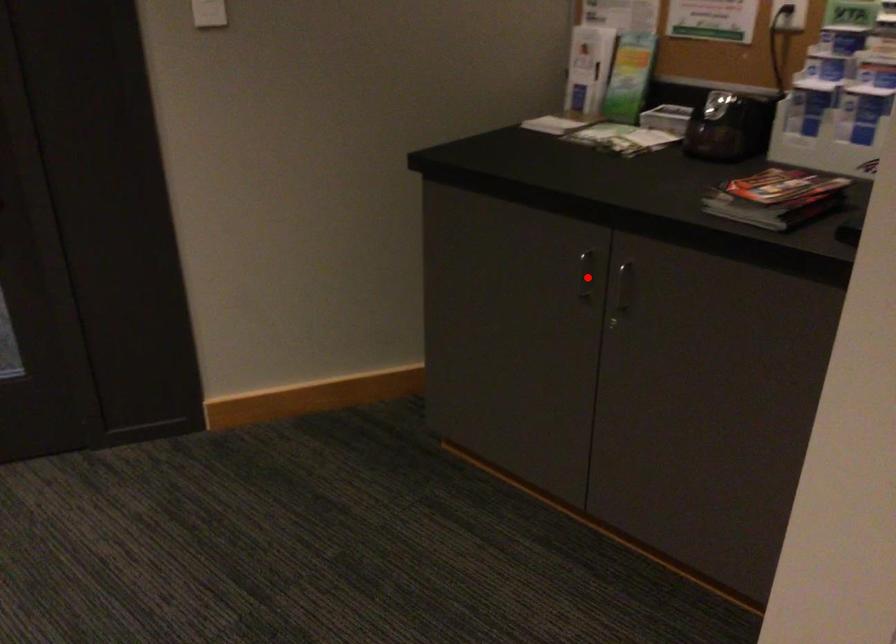
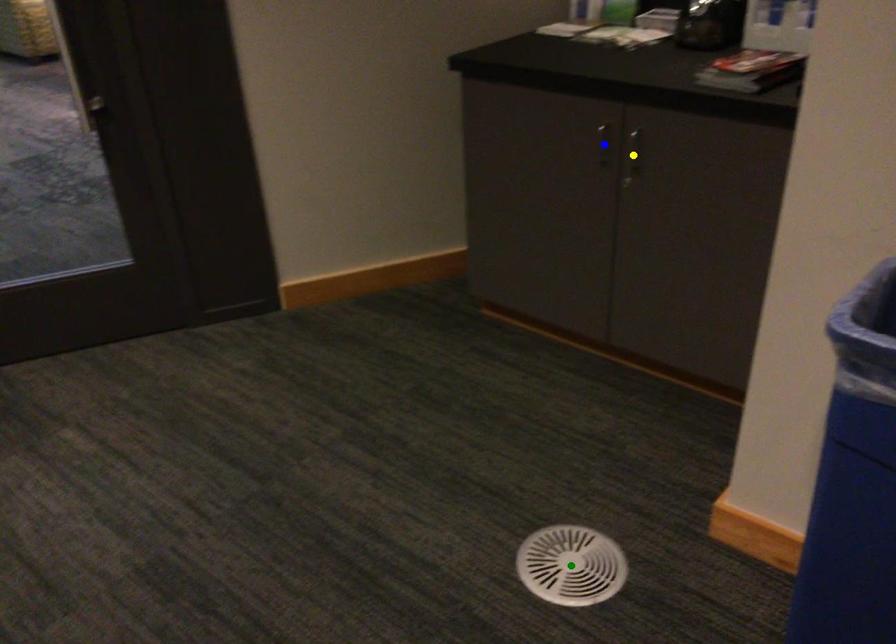
Question: I am providing you with two images of the same scene from different viewpoints. A red point is marked on the first image. You are given multiple points on the second image. In image 2, which mark is for the same physical point as the one in image 1?

Choices:
 (A) green point
 (B) yellow point
 (C) blue point

Answer: (C)